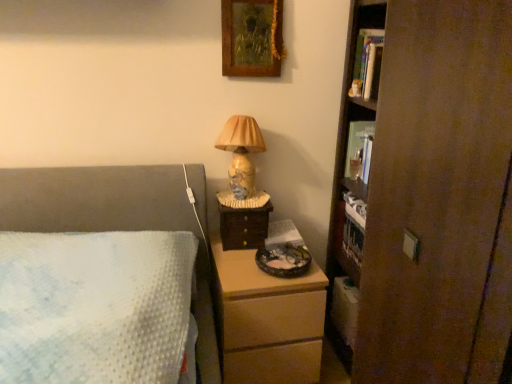
The height and width of the screenshot is (384, 512). I want to click on free spot above wooden drawer at right (from a real-world perspective), so click(x=243, y=200).